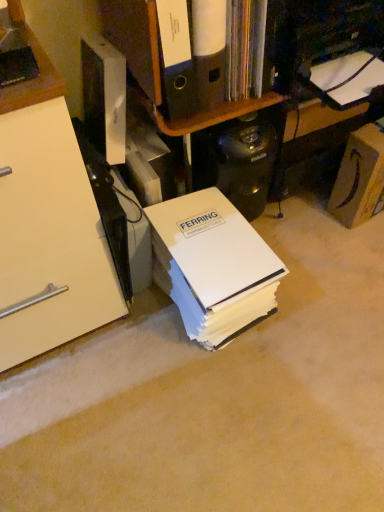
Question: Considering the positions of point (251, 273) and point (342, 189), is point (251, 273) closer or farther from the camera than point (342, 189)?

Choices:
 (A) farther
 (B) closer

Answer: (B)

Question: Looking at their shapes, would you say white paper at center is wider or thinner than matte brown cardboard box at right?

Choices:
 (A) wide
 (B) thin

Answer: (A)

Question: Estimate the real-world distances between objects in this image. Which object is farther from the black plastic computer tower at center?

Choices:
 (A) matte black coffee maker at upper right
 (B) white cardboard shelf at upper center
 (C) matte brown cardboard box at right
 (D) white paper at center

Answer: (C)

Question: Based on their relative distances, which object is nearer to the black plastic computer tower at center?

Choices:
 (A) white paper at center
 (B) matte brown cardboard box at right
 (C) matte black coffee maker at upper right
 (D) white cardboard shelf at upper center

Answer: (C)